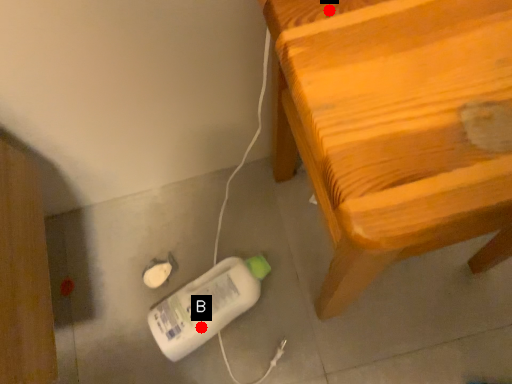
Question: Two points are circled on the image, labeled by A and B beside each circle. Which point appears farthest from the camera in this image?

Choices:
 (A) A is further
 (B) B is further

Answer: (B)